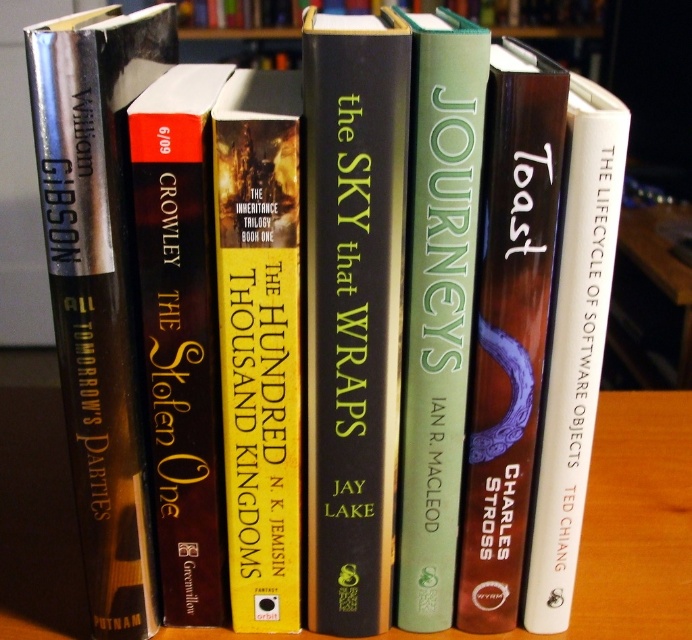
From the picture: You are looking at the arrangement of books on the wooden surface. There are two points marked on the books. The first point is at coordinates point (529, 390) and the second point is at point (427, 392). Which point is closer to you?

Point (529, 390) is further to the camera than point (427, 392), so the second point is closer to you.

You are standing in front of a wooden table at center and a yellow hardcover book at center. Which object is closer to you?

The wooden table at center is closer to you because it is further to the viewer than the yellow hardcover book at center.

You are organizing a bookshelf and notice the silver metallic book at left and the wooden table at center. Which object is positioned higher from the ground?

The silver metallic book at left is located above the wooden table at center, so it is positioned higher from the ground.